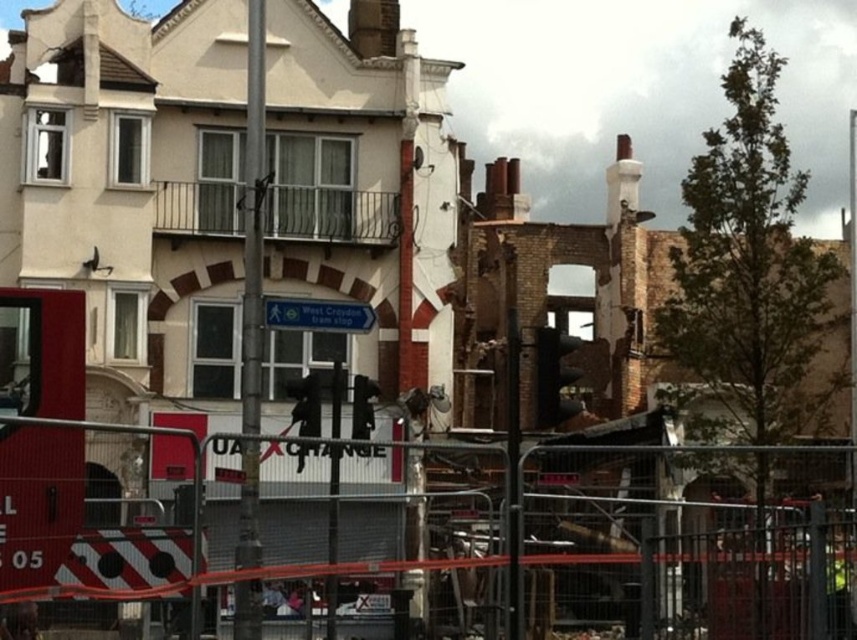
You are standing in the urban scene depicted. You need to reach a safety zone located behind the metal fence at center. Considering your current position, what is the minimum distance you must travel to reach the safety zone?

The metal fence at center is 57.45 meters away from the viewer, so the minimum distance you must travel to reach the safety zone behind it is 57.45 meters.

You are a delivery driver approaching the construction site. You see the metal fence at center and the blue plastic street sign at center. Which object is closer to the left side of the road?

The blue plastic street sign at center is closer to the left side of the road because the metal fence at center is to its right.